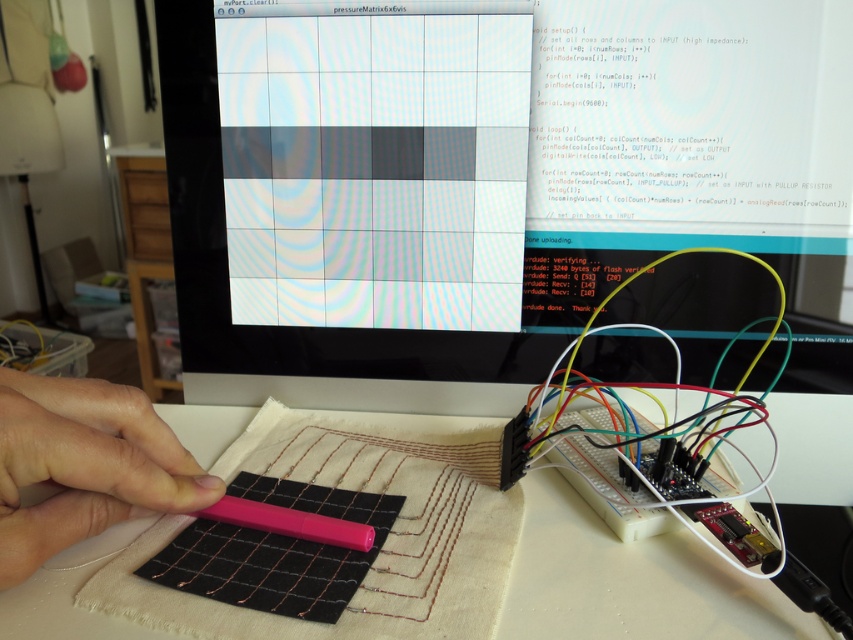
You are an engineer working on a project and need to place a component on the white fabric at center. However, there is a pink matte pen at lower left in the way. Can you place the component directly on the fabric without moving the pen?

The white fabric at center is positioned under the pink matte pen at lower left, so the pen is blocking access to the fabric. You would need to move the pen to place the component directly on the fabric.

You are setting up a circuit on the workspace and need to place both the white fabric at center and the pink matte pen at center. Since you have limited vertical space, which object should you prioritize placing first to ensure it fits?

The white fabric at center is much taller than the pink matte pen at center, so you should prioritize placing the white fabric at center first to accommodate its height in the limited vertical space.

You are a robot with a camera that is 14.72 inches away from a point in a workspace setup involving electronics and programming. The point is located at coordinates point (589, 568). Can you determine if the camera is positioned close enough to clearly see the point?

The point (589, 568) and camera are 14.72 inches apart, so the camera is positioned close enough to clearly see the point.